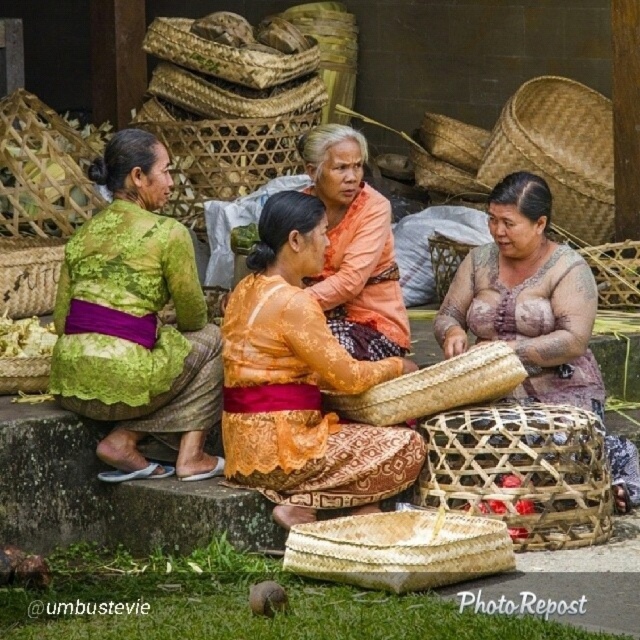
Is green lace skirt at left closer to the viewer compared to woven bamboo basket at center?

That is True.

Does point (145, 240) come in front of point (436, 273)?

Yes, point (145, 240) is in front of point (436, 273).

This screenshot has height=640, width=640. I want to click on green lace skirt at left, so click(136, 321).

Who is higher up, green lace skirt at left or orange lace fabric at center?

orange lace fabric at center is above.

Between point (154, 268) and point (314, 259), which one is positioned in front?

Positioned in front is point (154, 268).

Between point (193, 406) and point (269, 406), which one is positioned behind?

Positioned behind is point (193, 406).

You are a GUI agent. You are given a task and a screenshot of the screen. Output one action in this format:
    pyautogui.click(x=<x>, y=<y>)
    Task: Click on the green lace skirt at left
    
    Given the screenshot: What is the action you would take?
    pyautogui.click(x=136, y=321)

Does natural woven basket at upper center have a larger size compared to rope-like woven basket at left?

Yes.

Who is positioned more to the right, natural woven basket at upper center or rope-like woven basket at left?

From the viewer's perspective, natural woven basket at upper center appears more on the right side.

Where is `natural woven basket at upper center`? Image resolution: width=640 pixels, height=640 pixels. natural woven basket at upper center is located at coordinates (225, 54).

The image size is (640, 640). I want to click on natural woven basket at upper center, so click(225, 54).